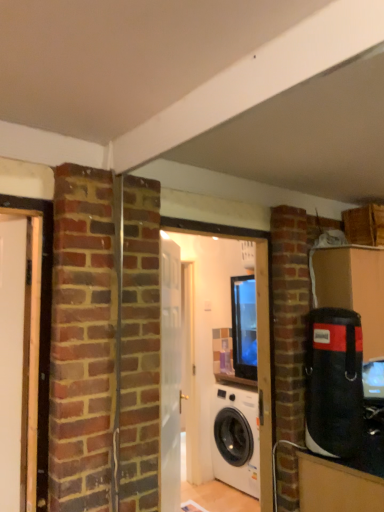
You are a GUI agent. You are given a task and a screenshot of the screen. Output one action in this format:
    pyautogui.click(x=<x>, y=<y>)
    Task: Click on the white glossy door at left
    
    Given the screenshot: What is the action you would take?
    pyautogui.click(x=12, y=358)

Describe the element at coordinates (12, 358) in the screenshot. I see `white glossy door at left` at that location.

The image size is (384, 512). I want to click on white glossy door at left, so pos(12,358).